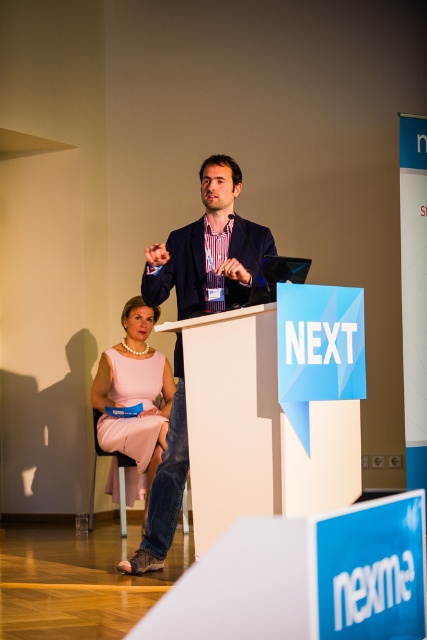
Question: Does dark blue suit at center have a greater width compared to pink satin dress at lower left?

Choices:
 (A) no
 (B) yes

Answer: (B)

Question: From the image, what is the correct spatial relationship of dark blue suit at center in relation to pink satin dress at lower left?

Choices:
 (A) above
 (B) below

Answer: (A)

Question: Which point is closer to the camera?

Choices:
 (A) pink satin dress at lower left
 (B) dark blue suit at center

Answer: (B)

Question: Can you confirm if dark blue suit at center is positioned above pink satin dress at lower left?

Choices:
 (A) yes
 (B) no

Answer: (A)

Question: Which object appears farthest from the camera in this image?

Choices:
 (A) dark blue suit at center
 (B) pink satin dress at lower left

Answer: (B)

Question: Among these points, which one is nearest to the camera?

Choices:
 (A) (123, 420)
 (B) (198, 220)

Answer: (B)